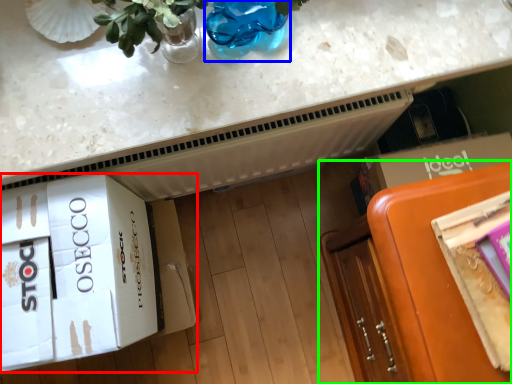
Question: Estimate the real-world distances between objects in this image. Which object is closer to cardboard box (highlighted by a red box), glass vase (highlighted by a blue box) or furniture (highlighted by a green box)?

Choices:
 (A) glass vase
 (B) furniture

Answer: (A)